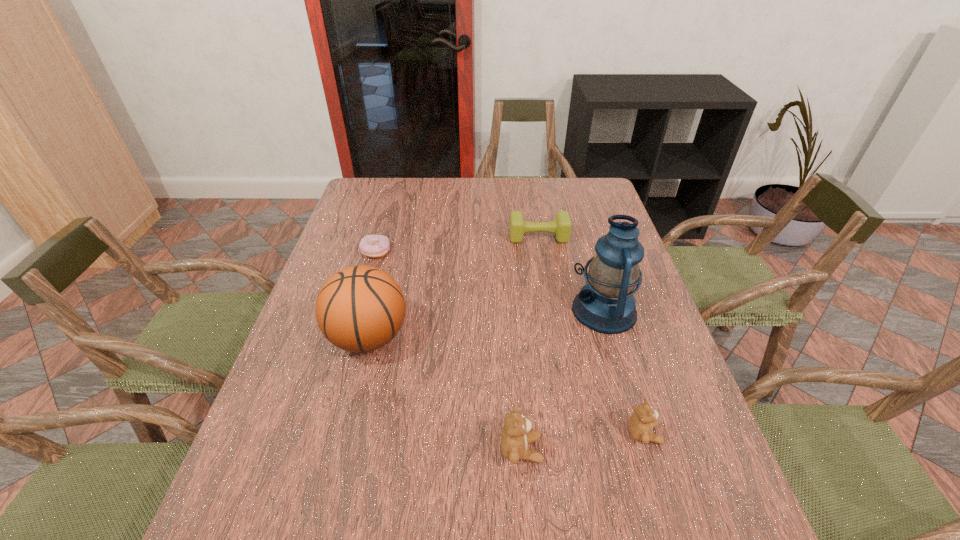
Locate an element on the screen. empty space that is in between the dumbbell and the taller teddy bear is located at coordinates (530, 343).

The width and height of the screenshot is (960, 540). I want to click on vacant space that's between the lantern and the fourth tallest object, so 624,372.

Locate an element on the screen. This screenshot has width=960, height=540. vacant area between the third shortest object and the fifth shortest object is located at coordinates (506, 385).

Locate an element on the screen. empty location between the fifth tallest object and the basketball is located at coordinates (453, 287).

At what (x,y) coordinates should I click in order to perform the action: click on free spot between the right teddy bear and the fifth shortest object. Please return your answer as a coordinate pair (x, y). Looking at the image, I should click on (506, 385).

Identify the location of object identified as the fourth closest to the third shortest object. (561, 226).

Identify which object is the fifth closest to the basketball. Please provide its 2D coordinates. Your answer should be formatted as a tuple, i.e. [(x, y)], where the tuple contains the x and y coordinates of a point satisfying the conditions above.

[(643, 420)]

The height and width of the screenshot is (540, 960). Identify the location of vacant area that satisfies the following two spatial constraints: 1. on the back side of the doughnut; 2. on the left side of the dumbbell. click(x=380, y=237).